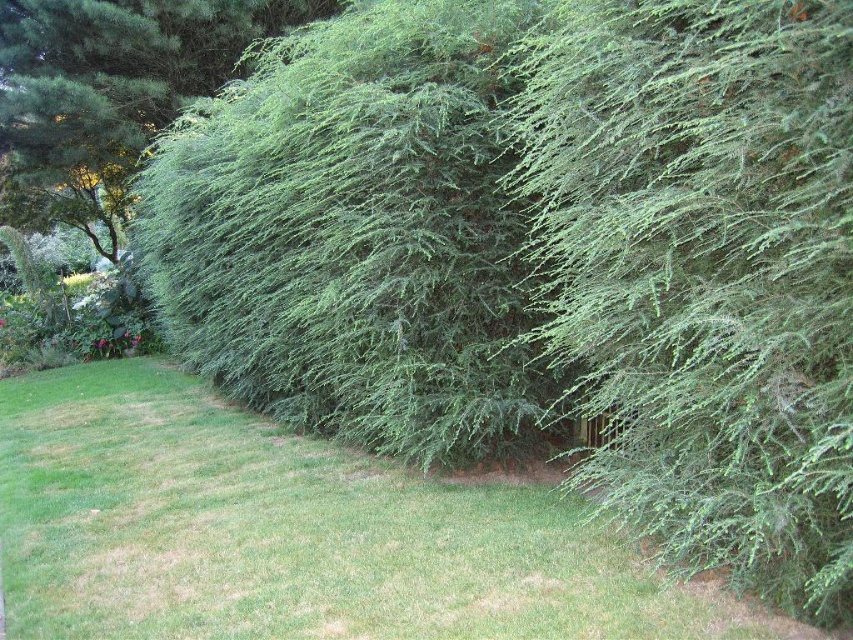
You are standing in the garden and want to place a small decorative statue. You have two options for placement marked by point coordinates. The first is at point (815, 445) and the second is at point (299, 182). Which point is closer to you where you are standing?

Point (815, 445) is closer to the viewer than point (299, 182), so you should place the statue at point (815, 445) since it is closer to your current position.